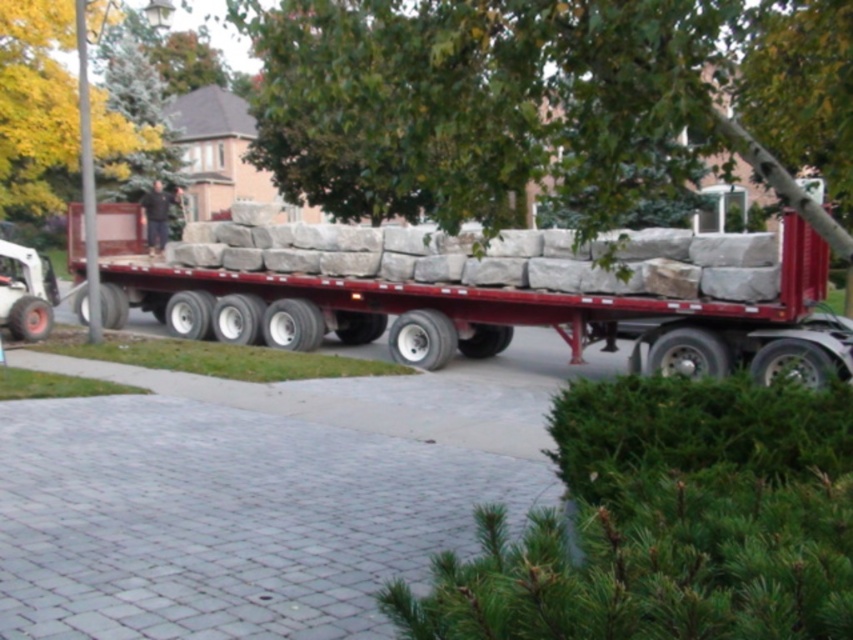
Which is more to the left, green leafy tree at upper center or green leafy tree at upper left?

From the viewer's perspective, green leafy tree at upper left appears more on the left side.

Does green leafy tree at upper center have a greater width compared to green leafy tree at upper left?

Correct, the width of green leafy tree at upper center exceeds that of green leafy tree at upper left.

Where is `green leafy tree at upper center`? green leafy tree at upper center is located at coordinates (502, 104).

Is green leafy tree at upper left closer to the viewer compared to dark brown leather jacket at center?

Yes.

How much distance is there between green leafy tree at upper left and dark brown leather jacket at center?

green leafy tree at upper left and dark brown leather jacket at center are 3.10 meters apart.

Image resolution: width=853 pixels, height=640 pixels. Identify the location of green leafy tree at upper left. (35, 106).

Identify the location of green leafy tree at upper left. (35, 106).

Who is taller, green leafy tree at upper center or dark brown leather jacket at center?

green leafy tree at upper center is taller.

What do you see at coordinates (502, 104) in the screenshot? This screenshot has width=853, height=640. I see `green leafy tree at upper center` at bounding box center [502, 104].

Who is more distant from viewer, (366, 170) or (154, 180)?

The point (154, 180) is more distant.

Image resolution: width=853 pixels, height=640 pixels. Find the location of `green leafy tree at upper center`. green leafy tree at upper center is located at coordinates (502, 104).